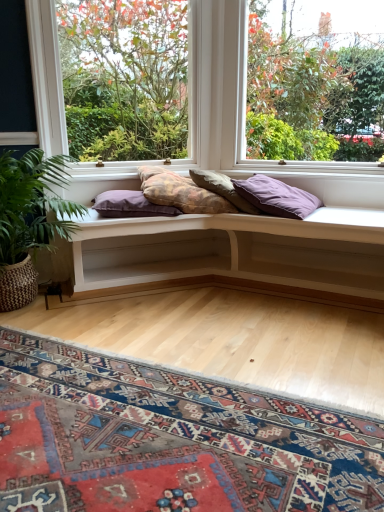
Question: Considering their positions, is textured purple pillow at center, the third pillow positioned from the right, located in front of or behind white wood bench at center?

Choices:
 (A) behind
 (B) front

Answer: (A)

Question: Looking at their shapes, would you say textured purple pillow at center, the third pillow positioned from the right, is wider or thinner than white wood bench at center?

Choices:
 (A) thin
 (B) wide

Answer: (A)

Question: Estimate the real-world distances between objects in this image. Which object is farther from the green leafy plant at lower left?

Choices:
 (A) purple fabric pillow at center, placed as the fourth pillow when sorted from right to left
 (B) white wood bench at center
 (C) clear glass window at upper right, the first window positioned from the right
 (D) clear glass window at center, which is the 1th window in left-to-right order
 (E) textured purple pillow at center, the third pillow positioned from the right

Answer: (D)

Question: Estimate the real-world distances between objects in this image. Which object is farther from the clear glass window at center, which is the 1th window in left-to-right order?

Choices:
 (A) textured purple pillow at center, which ranks as the 2th pillow in left-to-right order
 (B) carpeted mat at lower center
 (C) green leafy plant at lower left
 (D) textured beige pillow at center, acting as the second pillow starting from the right
 (E) purple matte pillow at center, acting as the first pillow starting from the right

Answer: (B)